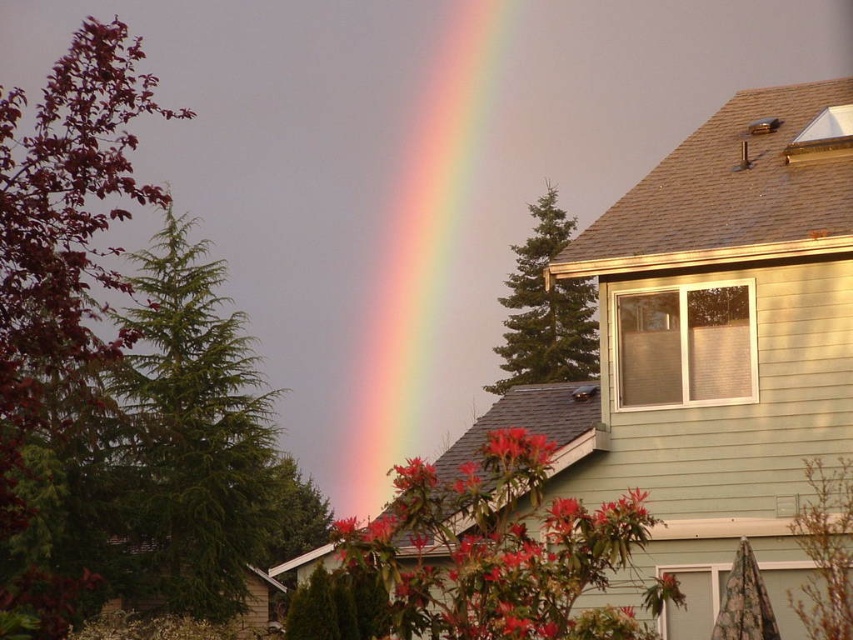
How distant is vivid red petals at center from fluffy pink flower at center?

They are 17.37 meters apart.

Can you confirm if vivid red petals at center is taller than fluffy pink flower at center?

Incorrect, vivid red petals at center's height is not larger of fluffy pink flower at center's.

Between point (482, 456) and point (430, 484), which one is positioned behind?

The point (482, 456) is more distant.

Find the location of `vivid red petals at center`. vivid red petals at center is located at coordinates (515, 449).

Can you confirm if rainbow at center is shorter than vivid red petals at center?

In fact, rainbow at center may be taller than vivid red petals at center.

Who is more forward, (381, 356) or (520, 461)?

Point (520, 461) is more forward.

Image resolution: width=853 pixels, height=640 pixels. I want to click on rainbow at center, so click(x=418, y=250).

Is red matte flower at center above vivid red petals at center?

No.

Is point (490, 490) positioned in front of point (505, 428)?

Yes.

Find the location of a particular element. red matte flower at center is located at coordinates (498, 557).